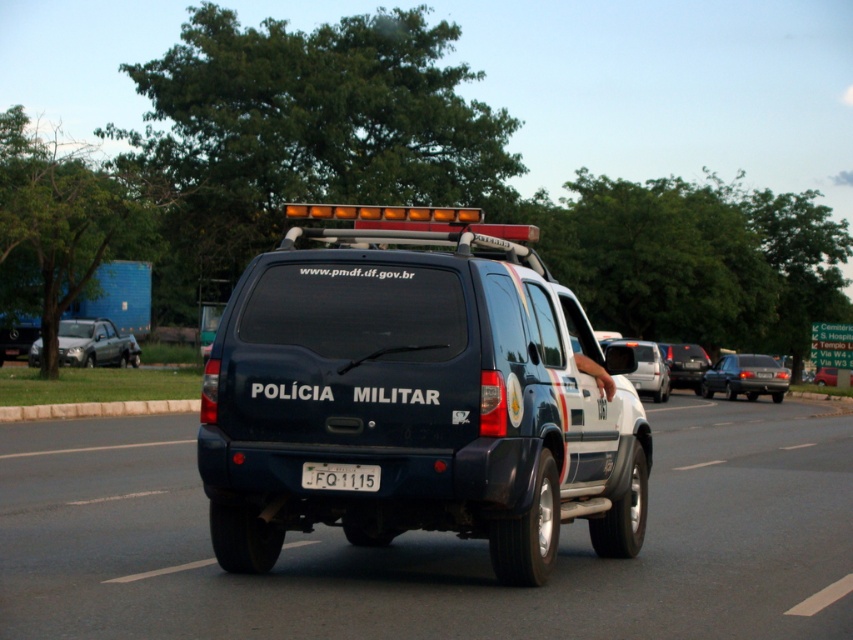
You are a driver approaching the intersection ahead. You see a glossy black suv at center and a matte black suv at center. Can you safely change lanes to pass both vehicles before the intersection? Please consider the distance between them.

The glossy black suv at center and the matte black suv at center are 28.64 meters apart. Since the distance between them is sufficient, you can safely change lanes to pass both vehicles before the intersection provided you maintain a safe speed and distance.

You are a driver approaching an intersection and see two police SUVs ahead. The glossy black suv at center and the matte black suv at center. Which one is taller?

The glossy black suv at center is much taller than the matte black suv at center.